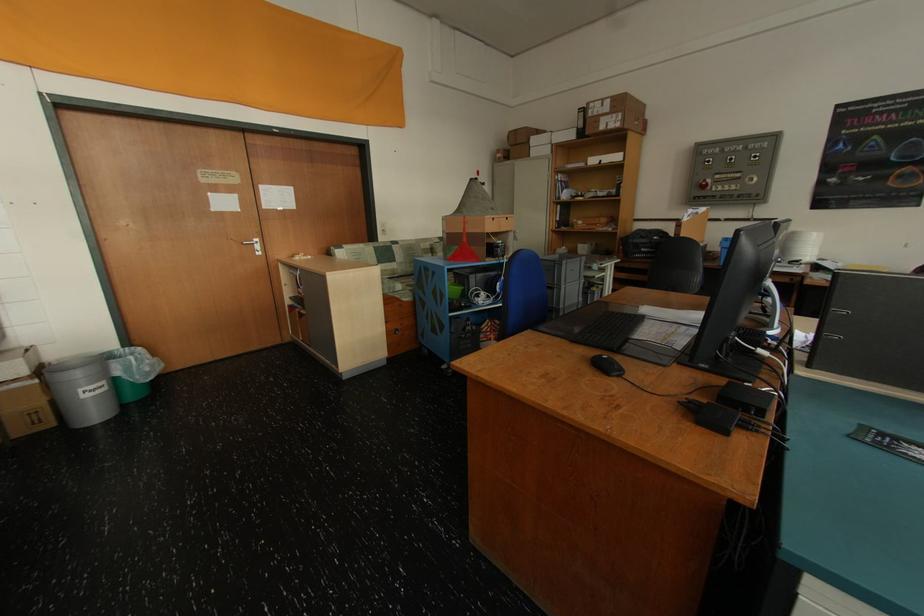
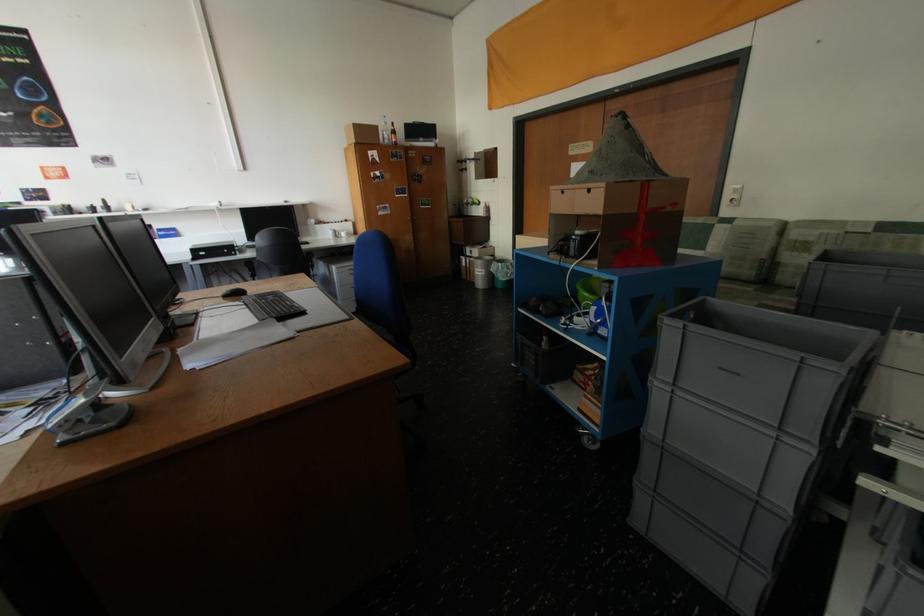
Find the pixel in the second image that matches point (90, 391) in the first image.

(484, 270)